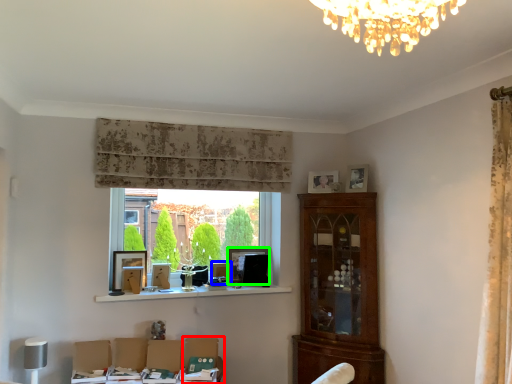
Question: Based on their relative distances, which object is nearer to swivel chair (highlighted by a red box)? Choose from picture frame (highlighted by a blue box) and picture frame (highlighted by a green box).

Choices:
 (A) picture frame
 (B) picture frame

Answer: (A)